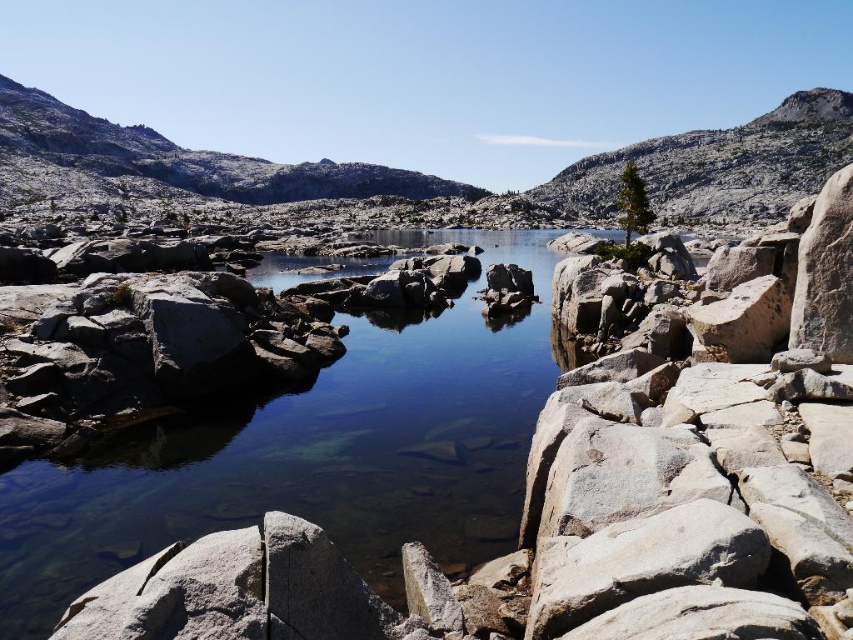
The width and height of the screenshot is (853, 640). I want to click on gray granite mountain at center, so click(428, 173).

Is gray granite mountain at center below gray granite mountain at upper right?

No, gray granite mountain at center is not below gray granite mountain at upper right.

Where is `gray granite mountain at center`? Image resolution: width=853 pixels, height=640 pixels. gray granite mountain at center is located at coordinates (428, 173).